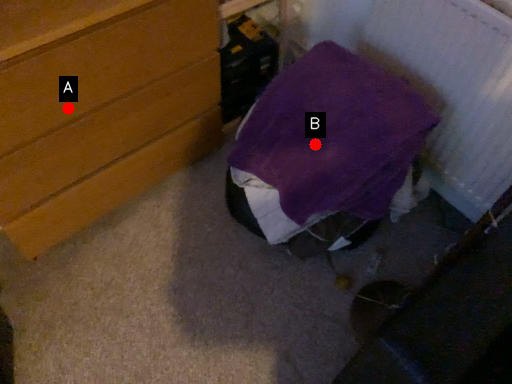
Question: Two points are circled on the image, labeled by A and B beside each circle. Which point appears farthest from the camera in this image?

Choices:
 (A) A is further
 (B) B is further

Answer: (B)